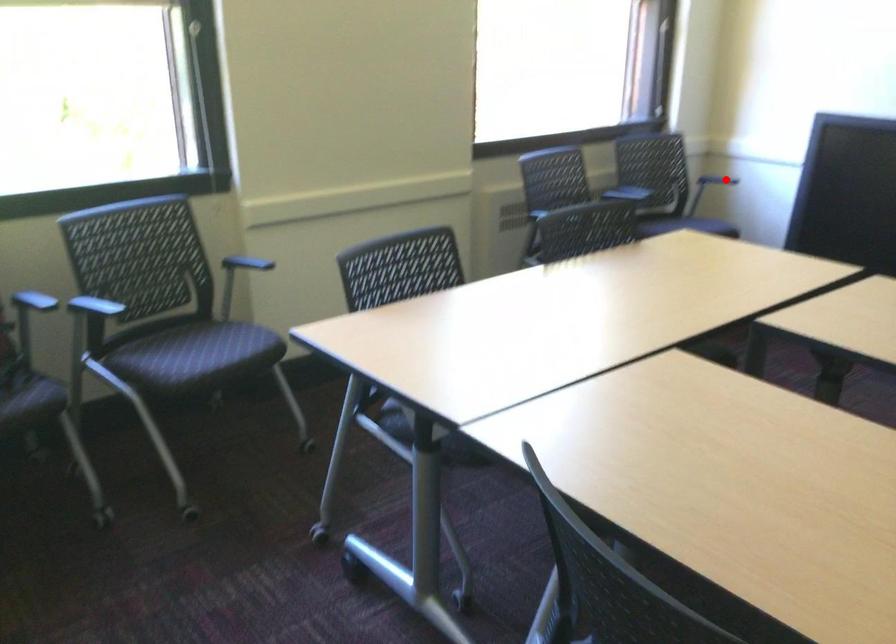
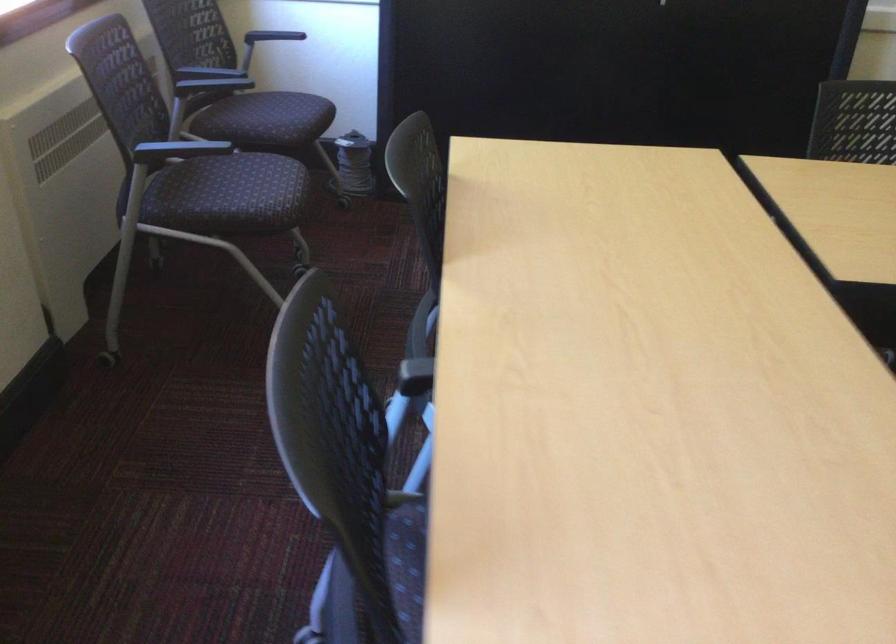
Question: I am providing you with two images of the same scene from different viewpoints. A red point is shown in image1. For the corresponding object point in image2, is it positioned nearer or farther from the camera?

Choices:
 (A) Nearer
 (B) Farther

Answer: (A)